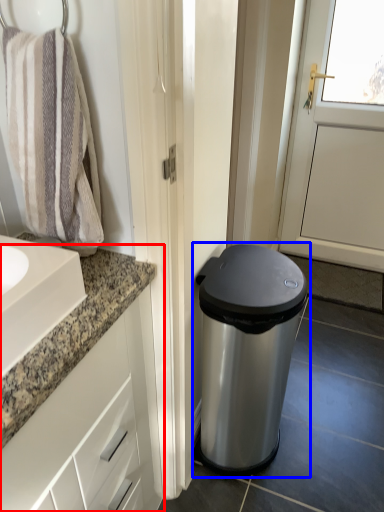
Question: Which object is further to the camera taking this photo, bathroom cabinet (highlighted by a red box) or waste container (highlighted by a blue box)?

Choices:
 (A) bathroom cabinet
 (B) waste container

Answer: (B)